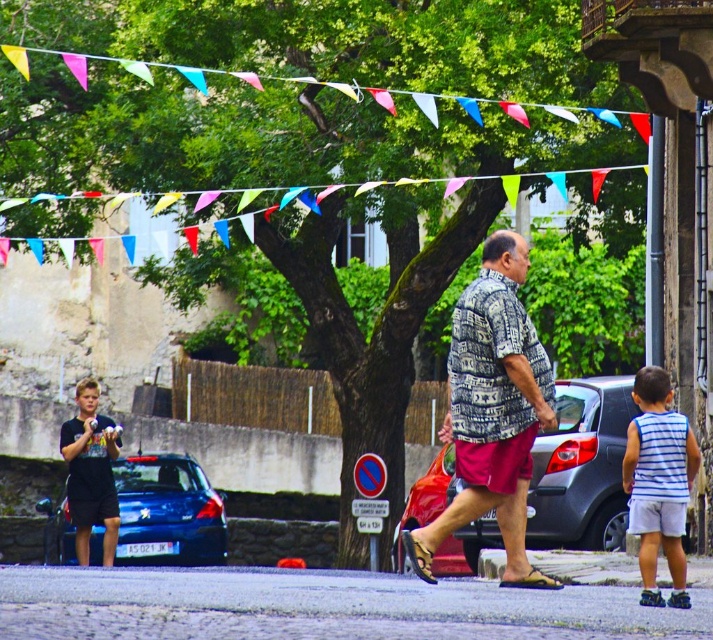
Which of these two, printed cotton shirt at center or shiny blue car at lower left, stands shorter?

Standing shorter between the two is shiny blue car at lower left.

Looking at this image, is printed cotton shirt at center bigger than shiny blue car at lower left?

Yes.

Is point (468, 305) positioned behind point (180, 518)?

That is False.

You are a GUI agent. You are given a task and a screenshot of the screen. Output one action in this format:
    pyautogui.click(x=<x>, y=<y>)
    Task: Click on the printed cotton shirt at center
    Image resolution: width=713 pixels, height=640 pixels.
    Given the screenshot: What is the action you would take?
    pyautogui.click(x=492, y=410)

Can you confirm if shiny red car at center is positioned to the left of shiny blue car at lower left?

In fact, shiny red car at center is to the right of shiny blue car at lower left.

Is shiny red car at center shorter than shiny blue car at lower left?

Yes.

Identify the location of shiny red car at center. (580, 467).

Does printed cotton shirt at center appear on the right side of shiny red car at center?

Incorrect, printed cotton shirt at center is not on the right side of shiny red car at center.

Can you confirm if printed cotton shirt at center is smaller than shiny red car at center?

No, printed cotton shirt at center is not smaller than shiny red car at center.

The image size is (713, 640). What do you see at coordinates (492, 410) in the screenshot?
I see `printed cotton shirt at center` at bounding box center [492, 410].

Locate an element on the screen. The width and height of the screenshot is (713, 640). printed cotton shirt at center is located at coordinates (492, 410).